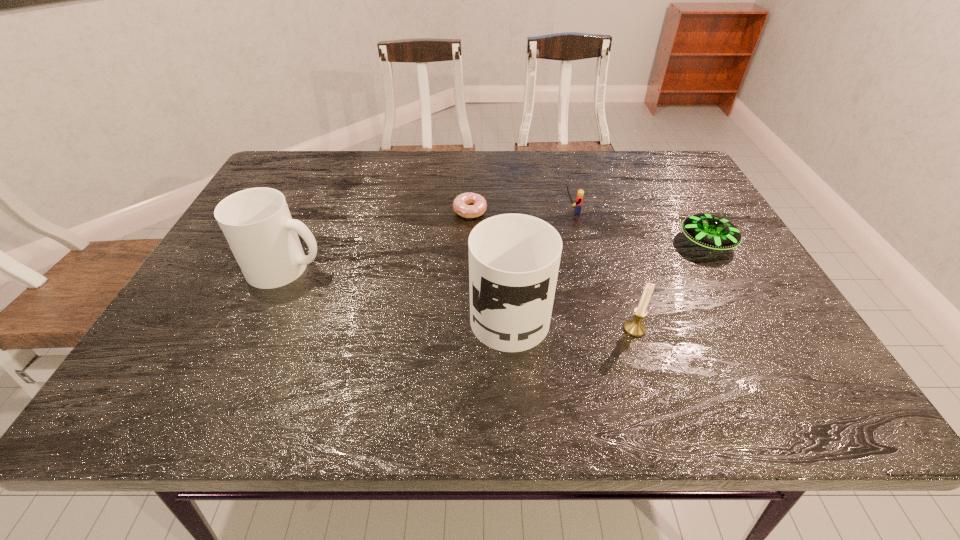
The height and width of the screenshot is (540, 960). I want to click on free location that satisfies the following two spatial constraints: 1. on the handle side of the candle holder; 2. on the right side of the fifth shortest object, so click(258, 329).

Image resolution: width=960 pixels, height=540 pixels. In order to click on free point that satisfies the following two spatial constraints: 1. on the front-facing side of the second shortest object; 2. on the right side of the third object from right to left in this screenshot , I will do `click(579, 242)`.

Where is `vacant area in the image that satisfies the following two spatial constraints: 1. on the handle side of the right mug; 2. on the left side of the second shortest object`? vacant area in the image that satisfies the following two spatial constraints: 1. on the handle side of the right mug; 2. on the left side of the second shortest object is located at coordinates (505, 242).

You are a GUI agent. You are given a task and a screenshot of the screen. Output one action in this format:
    pyautogui.click(x=<x>, y=<y>)
    Task: Click on the free region that satisfies the following two spatial constraints: 1. on the front-facing side of the fourth tallest object; 2. on the back side of the fifth object from left to right
    Image resolution: width=960 pixels, height=540 pixels.
    Given the screenshot: What is the action you would take?
    pyautogui.click(x=601, y=329)

The height and width of the screenshot is (540, 960). In order to click on vacant space that satisfies the following two spatial constraints: 1. on the handle side of the fifth shortest object; 2. on the handle side of the tallest object in this screenshot , I will do `click(268, 309)`.